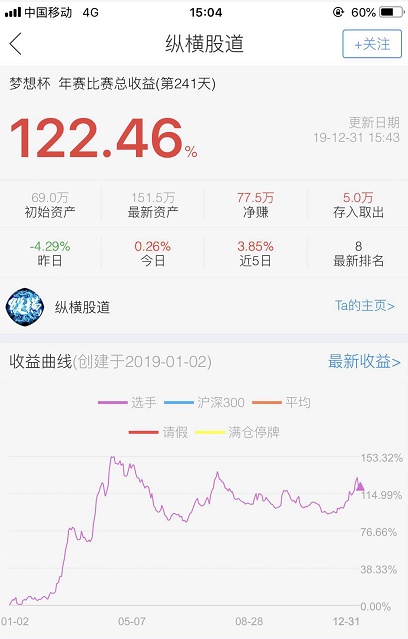
Where is `left of clock`? left of clock is located at coordinates (148, 13).